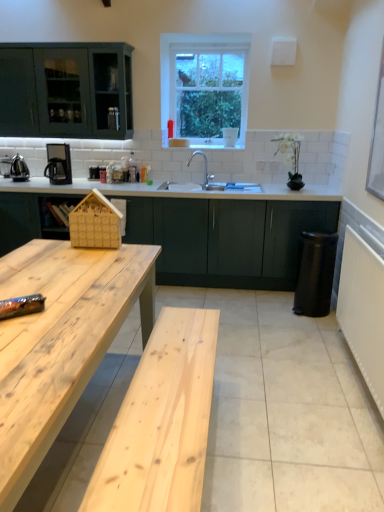
At what (x,y) coordinates should I click in order to perform the action: click on vacant space to the left of wooden house at center. Please return your answer as a coordinate pair (x, y). Looking at the image, I should click on (64, 248).